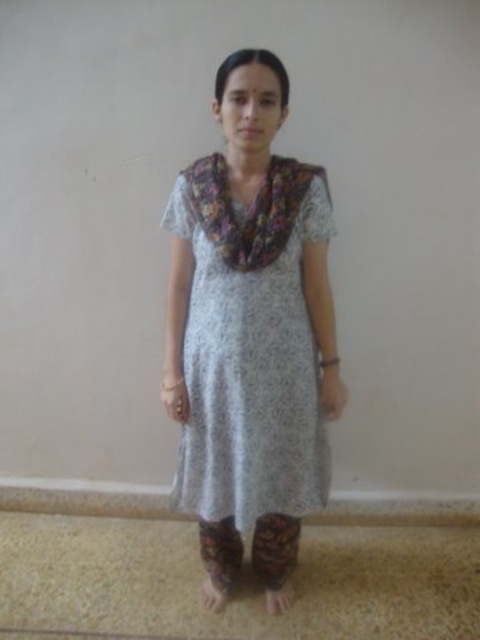
You are a fashion designer who wants to create a new outfit using the white printed dress at center and the floral fabric scarf at center. The client requires that the two items must be within 5 inches of each other in the final design. Can you achieve this requirement based on their current positions?

The white printed dress at center and floral fabric scarf at center are currently 6.01 inches apart from each other, which exceeds the client requirement of 5 inches. Therefore, the fashion designer cannot achieve the requirement with their current positions.

From the picture: You are a fashion designer trying to create a new outfit. You have a white printed dress at center and a floral fabric scarf at center. Which item has a greater width?

The white printed dress at center has a greater width than the floral fabric scarf at center.

Where is the white printed dress at center located in the image?

The white printed dress at center is located at point coordinates of 0.542 in the x axis and 0.521 in the y axis.